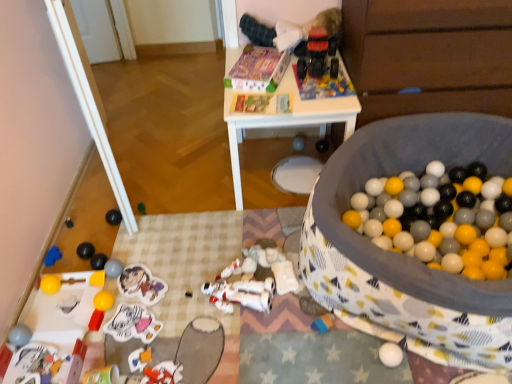
Identify the location of free space in front of rubberized red toy truck at upper center, the nineteenth toy from the left. (322, 89).